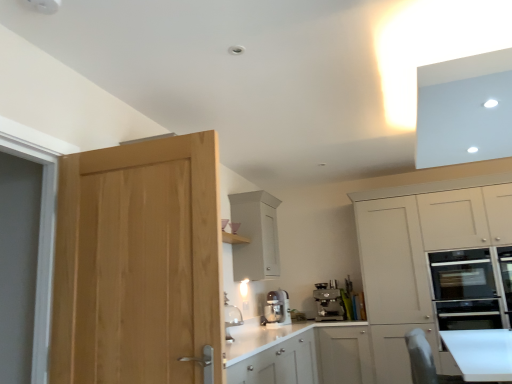
Question: From a real-world perspective, is satin silver coffee machine at lower center, the 2th kitchen appliance viewed from the left, positioned above or below white matte cabinet at upper center, which ranks as the 1th cabinetry in left-to-right order?

Choices:
 (A) above
 (B) below

Answer: (B)

Question: Considering their positions, is satin silver coffee machine at lower center, the 2th kitchen appliance viewed from the left, located in front of or behind white matte cabinet at upper center, which is counted as the second cabinetry, starting from the right?

Choices:
 (A) front
 (B) behind

Answer: (B)

Question: Based on their relative distances, which object is farther from the satin silver mixer at center, the second kitchen appliance viewed from the right?

Choices:
 (A) satin silver coffee machine at lower center, the first kitchen appliance viewed from the right
 (B) white glossy countertop at center
 (C) white matte cabinet at upper center, which is counted as the second cabinetry, starting from the right
 (D) white matte cabinet at right, acting as the second cabinetry starting from the left
 (E) natural wood door at left

Answer: (E)

Question: Which of these objects is positioned farthest from the natural wood door at left?

Choices:
 (A) white matte cabinet at right, acting as the second cabinetry starting from the left
 (B) white matte cabinet at upper center, which is counted as the second cabinetry, starting from the right
 (C) satin silver coffee machine at lower center, the 2th kitchen appliance viewed from the left
 (D) white glossy countertop at center
 (E) satin silver mixer at center, the second kitchen appliance viewed from the right

Answer: (C)